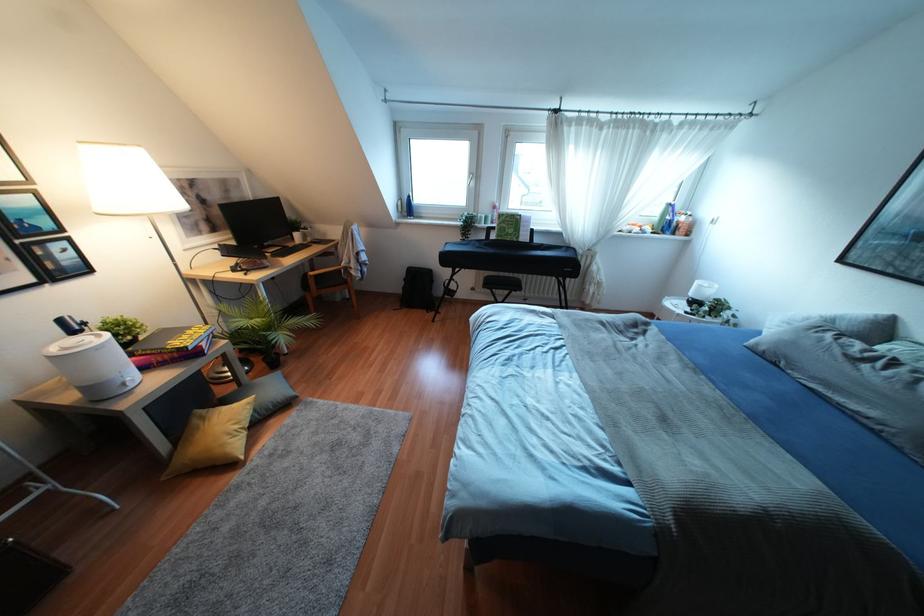
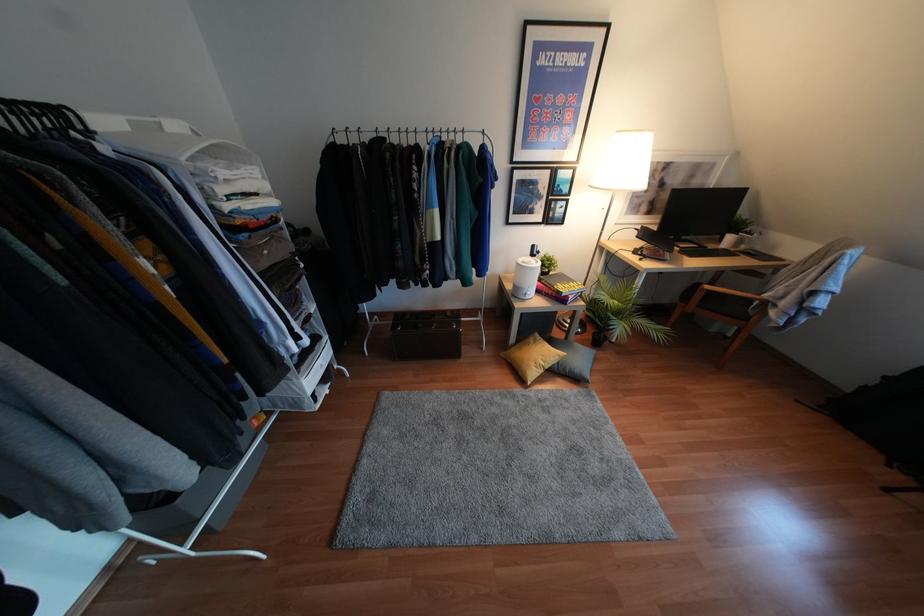
Where in the second image is the point corresponding to pixel 130 385 from the first image?

(526, 297)